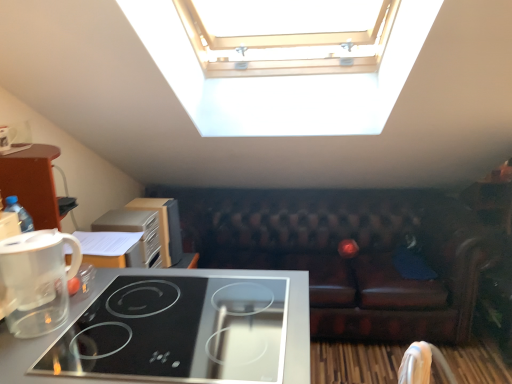
Question: Can you confirm if white fabric armchair at lower right is wider than wooden cabinet at left, marked as the first appliance in a back-to-front arrangement?

Choices:
 (A) yes
 (B) no

Answer: (B)

Question: Is white fabric armchair at lower right outside of wooden cabinet at left, marked as the first appliance in a back-to-front arrangement?

Choices:
 (A) yes
 (B) no

Answer: (A)

Question: Considering the relative positions of white fabric armchair at lower right and wooden cabinet at left, marked as the first appliance in a back-to-front arrangement, in the image provided, is white fabric armchair at lower right to the left of wooden cabinet at left, marked as the first appliance in a back-to-front arrangement, from the viewer's perspective?

Choices:
 (A) no
 (B) yes

Answer: (A)

Question: Is white fabric armchair at lower right surrounding wooden cabinet at left, the 2th appliance positioned from the front?

Choices:
 (A) yes
 (B) no

Answer: (B)

Question: Is the depth of white fabric armchair at lower right greater than that of wooden cabinet at left, marked as the first appliance in a back-to-front arrangement?

Choices:
 (A) no
 (B) yes

Answer: (A)

Question: Would you say white fabric armchair at lower right is a long distance from wooden cabinet at left, the 2th appliance positioned from the front?

Choices:
 (A) no
 (B) yes

Answer: (B)

Question: Is black glass cooktop at lower left in contact with brown leather couch at center?

Choices:
 (A) no
 (B) yes

Answer: (A)

Question: Considering the relative sizes of black glass cooktop at lower left and brown leather couch at center in the image provided, is black glass cooktop at lower left bigger than brown leather couch at center?

Choices:
 (A) no
 (B) yes

Answer: (A)

Question: Considering the relative sizes of black glass cooktop at lower left and brown leather couch at center in the image provided, is black glass cooktop at lower left smaller than brown leather couch at center?

Choices:
 (A) no
 (B) yes

Answer: (B)

Question: From a real-world perspective, is black glass cooktop at lower left positioned over brown leather couch at center based on gravity?

Choices:
 (A) yes
 (B) no

Answer: (A)

Question: Is black glass cooktop at lower left far from brown leather couch at center?

Choices:
 (A) no
 (B) yes

Answer: (B)

Question: Would you say black glass cooktop at lower left contains brown leather couch at center?

Choices:
 (A) no
 (B) yes

Answer: (A)

Question: Is white fabric armchair at lower right shorter than black glass cooktop at lower left?

Choices:
 (A) no
 (B) yes

Answer: (B)